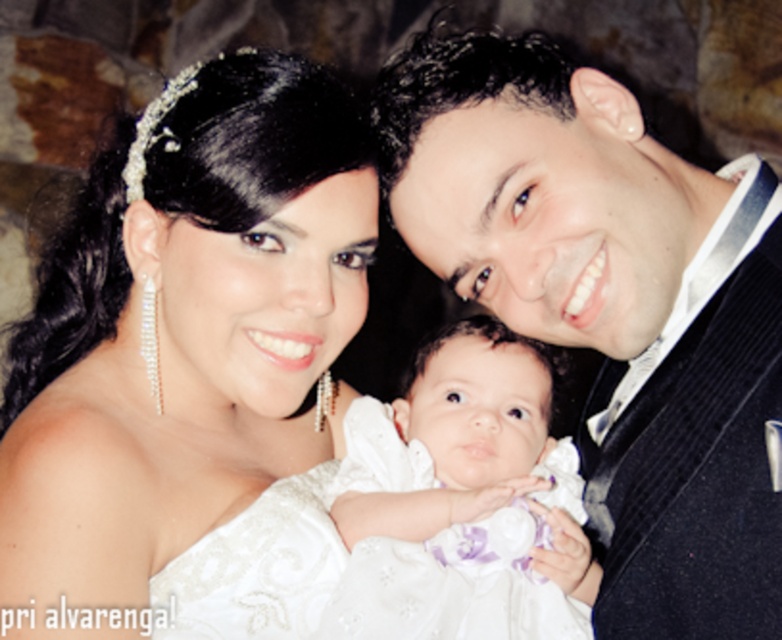
You are a photographer adjusting your camera settings to focus on two specific points in the image. The first point is at coordinate point [404,483] and the second point is at coordinate point [135,193]. Which point should you focus on first if you want to capture the closest object to the camera?

Point [404,483] is further to the camera than point [135,193], so you should focus on point [404,483] first as it is closer to the camera.

You are a photographer setting up for a family portrait. You need to ensure that the satin black suit at upper right and the clear crystal tiara at upper center are both visible in the frame. Based on their sizes, which object will appear larger in the photo?

The satin black suit at upper right will appear larger in the photo because it is taller than the clear crystal tiara at upper center.